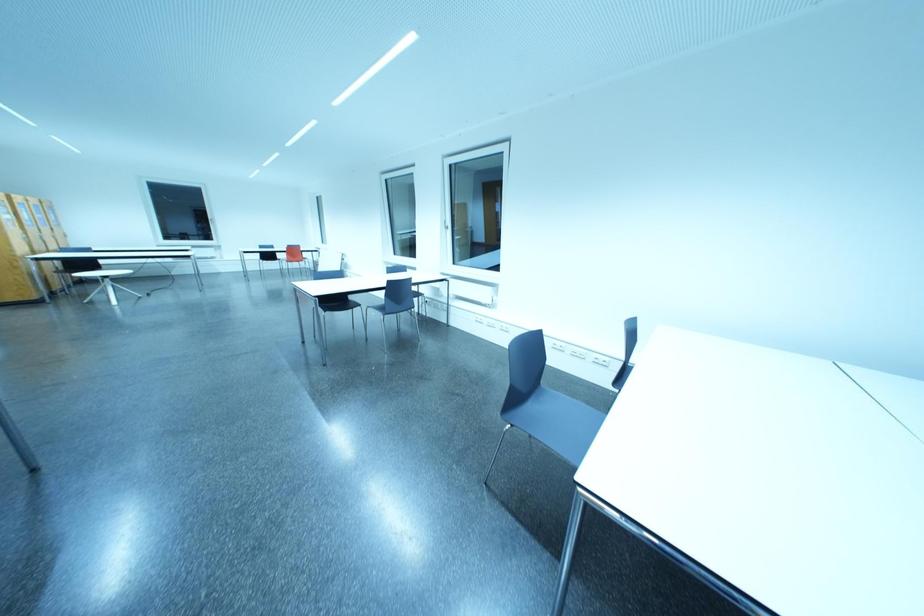
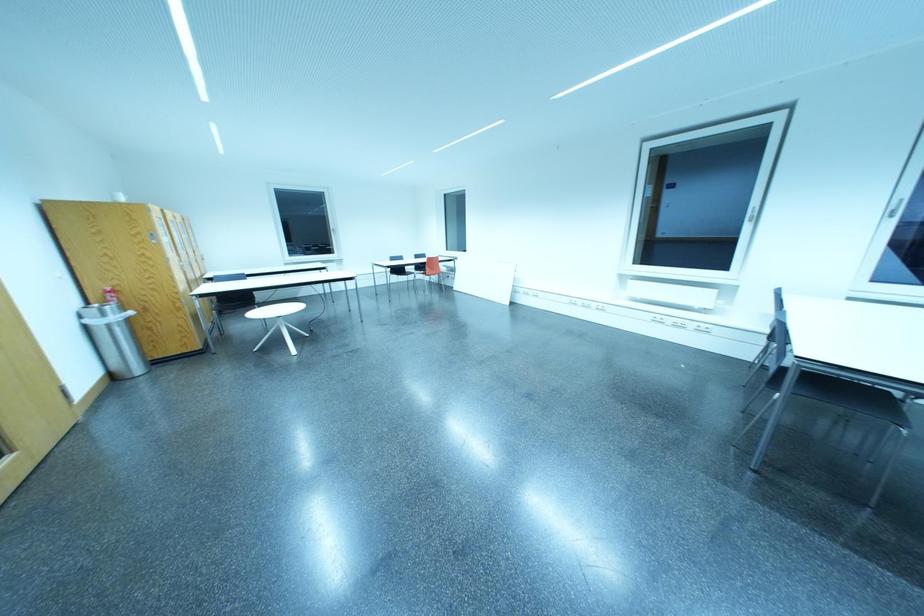
What movement of the cameraman would produce the second image?

The cameraman moved toward left, forward.